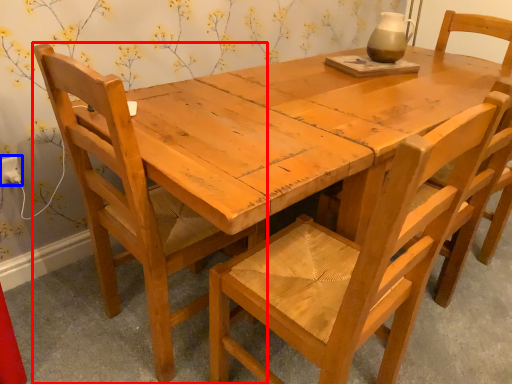
Question: Which point is further to the camera, chair (highlighted by a red box) or electric outlet (highlighted by a blue box)?

Choices:
 (A) chair
 (B) electric outlet

Answer: (B)